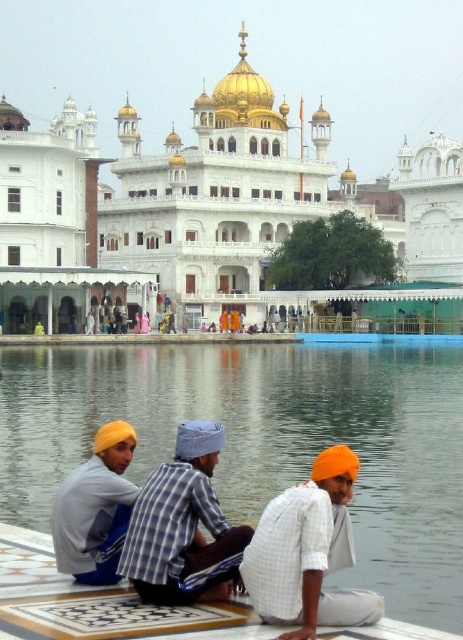
Can you confirm if blue plaid shirt at center is thinner than yellow turban at lower left?

Incorrect, blue plaid shirt at center's width is not less than yellow turban at lower left's.

Is point (181, 531) positioned in front of point (117, 547)?

Yes, point (181, 531) is closer to viewer.

I want to click on blue plaid shirt at center, so click(x=182, y=525).

The height and width of the screenshot is (640, 463). I want to click on blue plaid shirt at center, so click(182, 525).

Can you confirm if clear water at lower center is thinner than orange matte turban at lower center?

In fact, clear water at lower center might be wider than orange matte turban at lower center.

Who is more forward, (405, 481) or (312, 636)?

Point (312, 636)

Is point (120, 356) positioned behind point (349, 618)?

Yes.

At what (x,y) coordinates should I click in order to perform the action: click on clear water at lower center. Please return your answer as a coordinate pair (x, y). Looking at the image, I should click on (266, 440).

Who is positioned more to the right, orange matte turban at lower center or yellow turban at lower left?

From the viewer's perspective, orange matte turban at lower center appears more on the right side.

Is point (294, 570) farther from viewer compared to point (125, 492)?

That is False.

You are a GUI agent. You are given a task and a screenshot of the screen. Output one action in this format:
    pyautogui.click(x=<x>, y=<y>)
    Task: Click on the orange matte turban at lower center
    This screenshot has height=640, width=463.
    Given the screenshot: What is the action you would take?
    pyautogui.click(x=307, y=552)